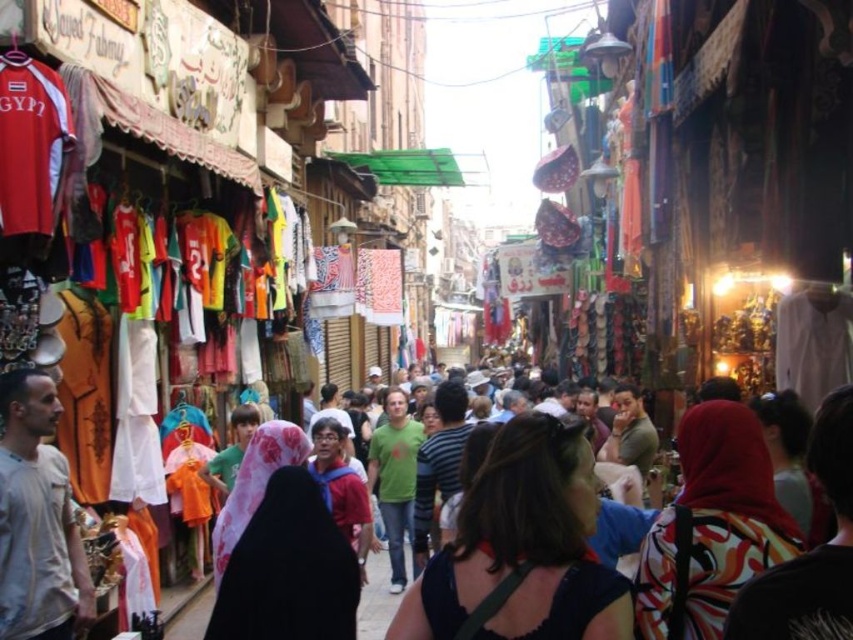
You are a customer in the market looking to buy a headscarf and a shirt. You notice both the printed fabric headscarf at center and the green matte shirt at center. Which item is positioned higher up?

The printed fabric headscarf at center is above the green matte shirt at center, so it is positioned higher up.

You are a tourist in the market and want to take a photo of both the dark brown hair at center and the printed fabric headscarf at center. Since you can only focus on one object at a time, which one should you aim your camera at to ensure both are in the frame?

You should aim your camera at the dark brown hair at center because it is to the left of the printed fabric headscarf at center, so centering on the left object will include both in the frame.